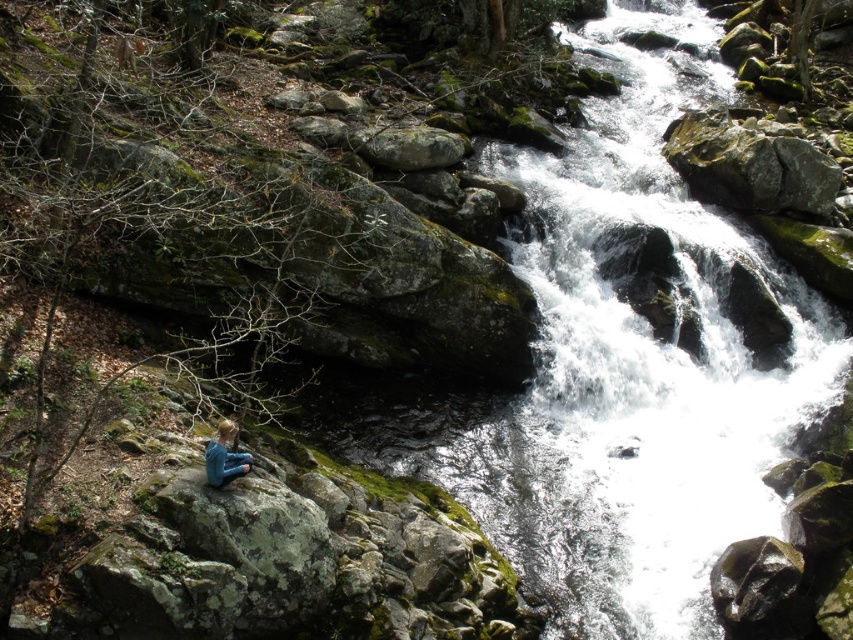
You are a photographer planning to take a wide shot of the scene. The green mossy rock at center and the blue fabric person at lower left are both in the frame. Which object takes up more space in the photo?

The green mossy rock at center takes up more space in the photo because it is bigger than the blue fabric person at lower left.

You are planning to place a small decorative garden gnome on the green mossy rock at center and the blue fabric person at lower left. Based on the scene, which object can the gnome fit on without falling off?

The green mossy rock at center has a larger width than the blue fabric person at lower left, so the gnome can fit on the green mossy rock at center.